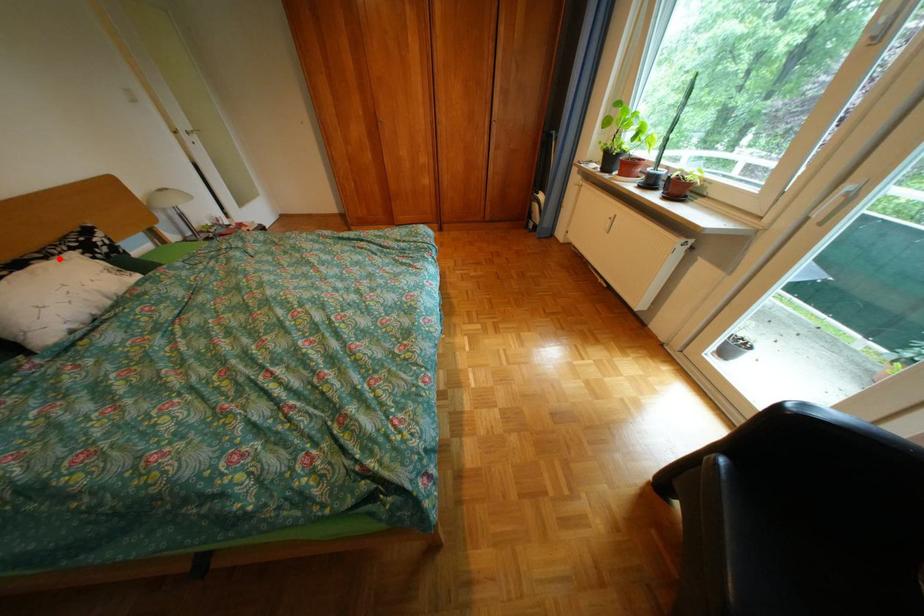
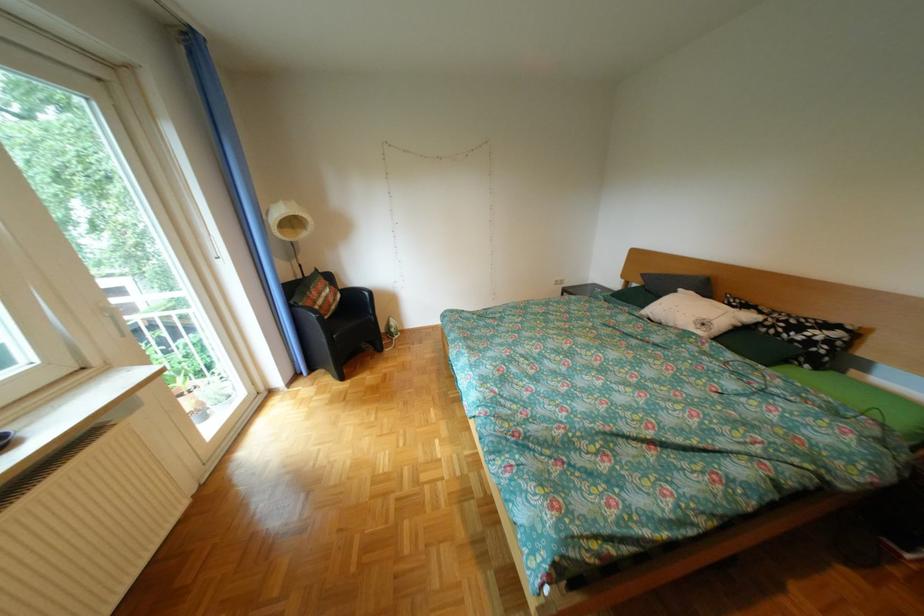
Question: I am providing you with two images of the same scene from different viewpoints. A red point is shown in image1. For the corresponding object point in image2, is it positioned nearer or farther from the camera?

Choices:
 (A) Nearer
 (B) Farther

Answer: (A)